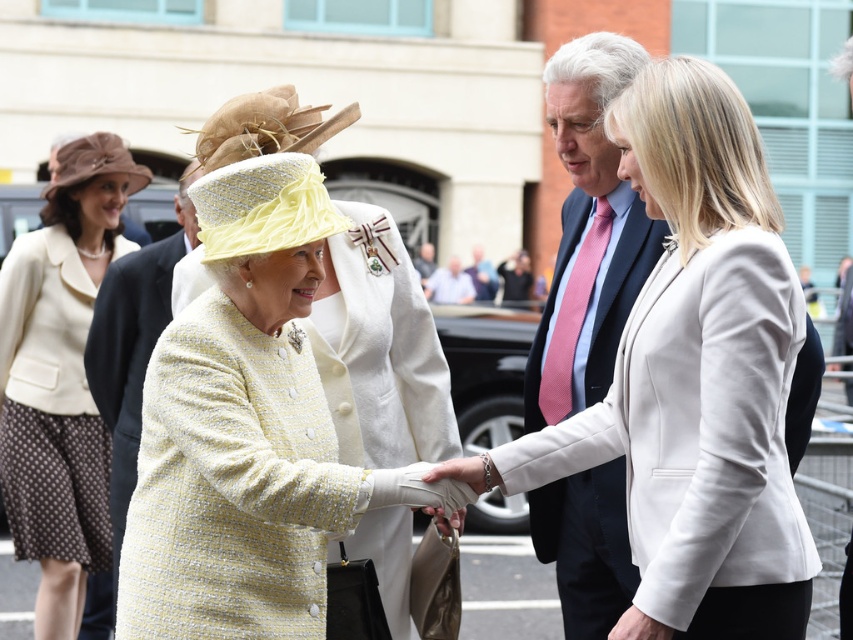
You are standing in the scene and want to locate the yellow tweed coat at center. According to the coordinates provided, where would you find it?

The yellow tweed coat at center is located at the 2D coordinates point (247, 429).

You are standing in the scene and need to locate the dark blue suit at center. According to the coordinates provided, where would you find it?

The dark blue suit at center is located at point 0.367 along the horizontal axis and 0.691 along the vertical axis.